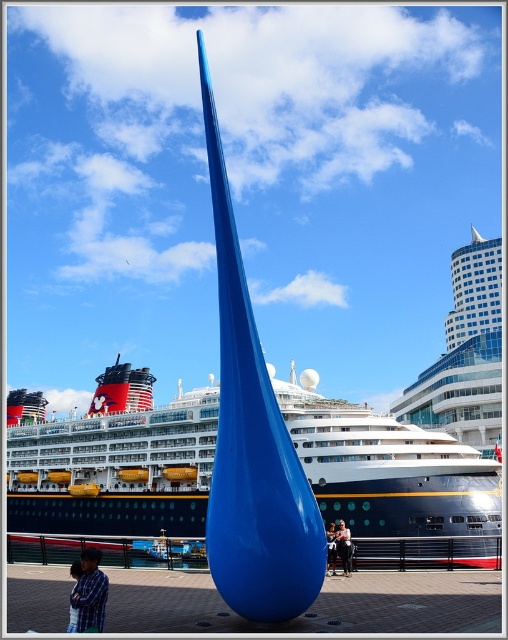
You are standing at the point marked as point (x=114, y=468) in the image. Looking around, you notice a shiny blue ship at center. Which direction should you face to see the cruise ship?

The point (x=114, y=468) is on the shiny blue ship at center, so you are already facing the cruise ship.

What does the point at coordinates (x=114, y=468) in the image represent?

The point at coordinates (x=114, y=468) marks the shiny blue ship at center.

You are an artist trying to paint the scene. You need to decide which object to sketch first based on their sizes. Which object should you start with, the shiny blue ship at center or the plaid shirt at lower left?

The shiny blue ship at center is bigger than the plaid shirt at lower left, so you should start with the shiny blue ship at center since larger objects are typically sketched first to establish the main elements of the scene.